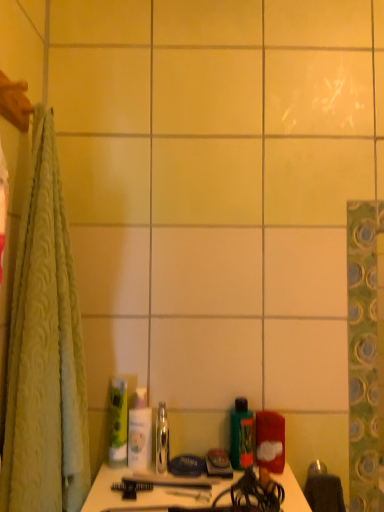
Question: Considering the positions of point (165, 431) and point (132, 425), is point (165, 431) closer or farther from the camera than point (132, 425)?

Choices:
 (A) farther
 (B) closer

Answer: (A)

Question: Do you think clear plastic mouthwash at center, placed as the first mouthwash when sorted from left to right, is within white glossy lotion at center, arranged as the 2th toiletry when viewed from the right, or outside of it?

Choices:
 (A) inside
 (B) outside

Answer: (B)

Question: Which of these objects is positioned farthest from the matte red container at lower right, which is counted as the 1th toiletry, starting from the right?

Choices:
 (A) white glossy lotion at center, placed as the 2th toiletry when sorted from left to right
 (B) clear plastic mouthwash at center, placed as the first mouthwash when sorted from left to right
 (C) green matte bottle at center, which is the second mouthwash from left to right
 (D) green matte tube at center, the first toiletry when ordered from left to right

Answer: (D)

Question: Estimate the real-world distances between objects in this image. Which object is farther from the green matte bottle at center, arranged as the first mouthwash when viewed from the right?

Choices:
 (A) matte red container at lower right, which is counted as the 1th toiletry, starting from the right
 (B) clear plastic mouthwash at center, placed as the first mouthwash when sorted from left to right
 (C) green matte tube at center, the first toiletry when ordered from left to right
 (D) white glossy lotion at center, placed as the 2th toiletry when sorted from left to right

Answer: (C)